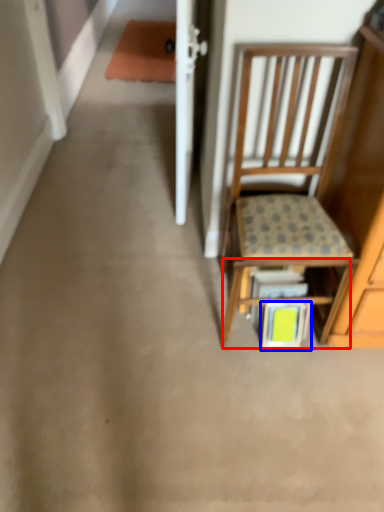
Question: Which point is further to the camera, shelf (highlighted by a red box) or book (highlighted by a blue box)?

Choices:
 (A) shelf
 (B) book

Answer: (B)